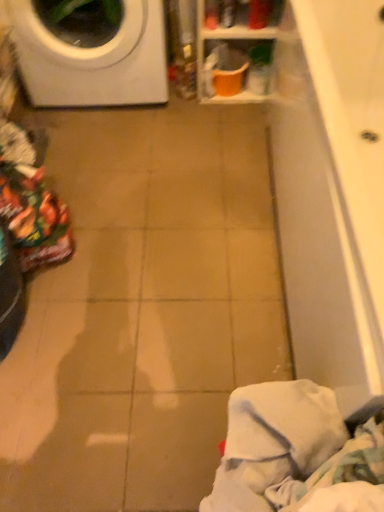
Locate an element on the screen. free space in front of white glossy washing machine at upper left is located at coordinates (122, 156).